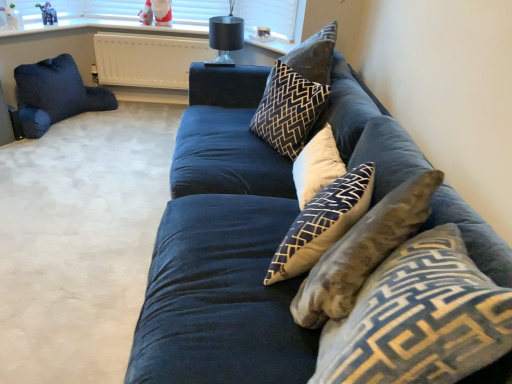
At what (x,y) coordinates should I click in order to perform the action: click on spots to the right of dark blue velvet pillow at left, which is the fifth pillow from front to back. Please return your answer as a coordinate pair (x, y). Image resolution: width=512 pixels, height=384 pixels. Looking at the image, I should click on (126, 129).